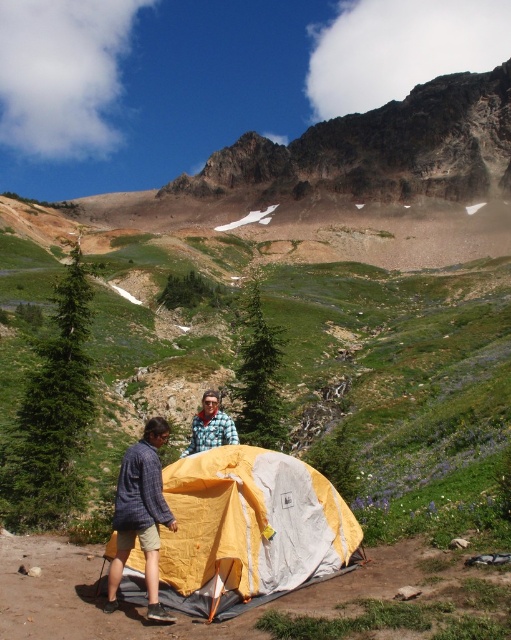
Can you confirm if yellow fabric tent at lower center is positioned to the right of brushed metal jacket at center?

Indeed, yellow fabric tent at lower center is positioned on the right side of brushed metal jacket at center.

Is yellow fabric tent at lower center above brushed metal jacket at center?

No.

Does point (200, 532) come in front of point (224, 433)?

Yes, it is.

The width and height of the screenshot is (511, 640). In order to click on yellow fabric tent at lower center in this screenshot , I will do `click(249, 531)`.

Does yellow fabric tent at lower center have a lesser width compared to plaid shirt at center?

No, yellow fabric tent at lower center is not thinner than plaid shirt at center.

Who is more distant from viewer, (251, 488) or (150, 589)?

Point (251, 488)

This screenshot has width=511, height=640. I want to click on yellow fabric tent at lower center, so click(249, 531).

Does yellow fabric tent at center appear under plaid shirt at center?

Incorrect, yellow fabric tent at center is not positioned below plaid shirt at center.

The width and height of the screenshot is (511, 640). Describe the element at coordinates (141, 515) in the screenshot. I see `yellow fabric tent at center` at that location.

Which is in front, point (128, 541) or point (117, 538)?

Positioned in front is point (128, 541).

Image resolution: width=511 pixels, height=640 pixels. I want to click on yellow fabric tent at center, so click(141, 515).